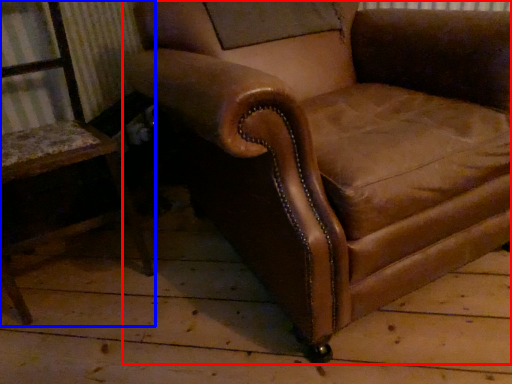
Question: Which of the following is the closest to the observer, chair (highlighted by a red box) or chair (highlighted by a blue box)?

Choices:
 (A) chair
 (B) chair

Answer: (A)